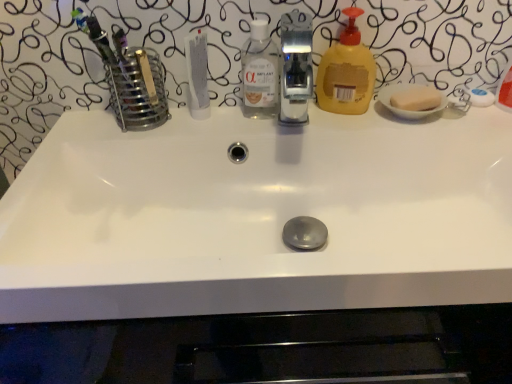
Question: Is satin nickel faucet at center taller or shorter than white matte tube at center?

Choices:
 (A) tall
 (B) short

Answer: (A)

Question: Looking at their shapes, would you say satin nickel faucet at center is wider or thinner than white matte tube at center?

Choices:
 (A) wide
 (B) thin

Answer: (A)

Question: Estimate the real-world distances between objects in this image. Which object is closer to the satin nickel faucet at center?

Choices:
 (A) yellow translucent liquid soap at right
 (B) white matte tube at center
 (C) transparent plastic bottle at center

Answer: (A)

Question: Estimate the real-world distances between objects in this image. Which object is farther from the yellow translucent liquid soap at right?

Choices:
 (A) satin nickel faucet at center
 (B) transparent plastic bottle at center
 (C) white matte tube at center

Answer: (A)